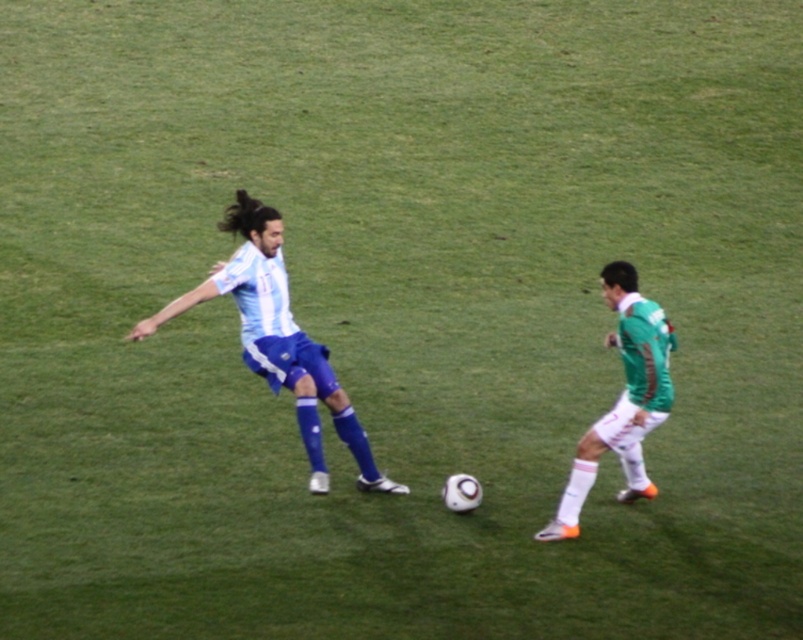
Question: Can you confirm if white matte soccer ball at center is wider than green matte jersey at right?

Choices:
 (A) no
 (B) yes

Answer: (B)

Question: Can you confirm if white matte soccer ball at center is wider than white matte jersey at center?

Choices:
 (A) no
 (B) yes

Answer: (A)

Question: Which point is closer to the camera taking this photo?

Choices:
 (A) (312, 467)
 (B) (613, 445)

Answer: (B)

Question: Which object appears closest to the camera in this image?

Choices:
 (A) green matte jersey at right
 (B) white matte jersey at center
 (C) white matte soccer ball at center

Answer: (A)

Question: Which object appears closest to the camera in this image?

Choices:
 (A) white matte jersey at center
 (B) white matte soccer ball at center
 (C) green matte jersey at right

Answer: (C)

Question: Observing the image, what is the correct spatial positioning of white matte jersey at center in reference to green matte jersey at right?

Choices:
 (A) above
 (B) below

Answer: (A)